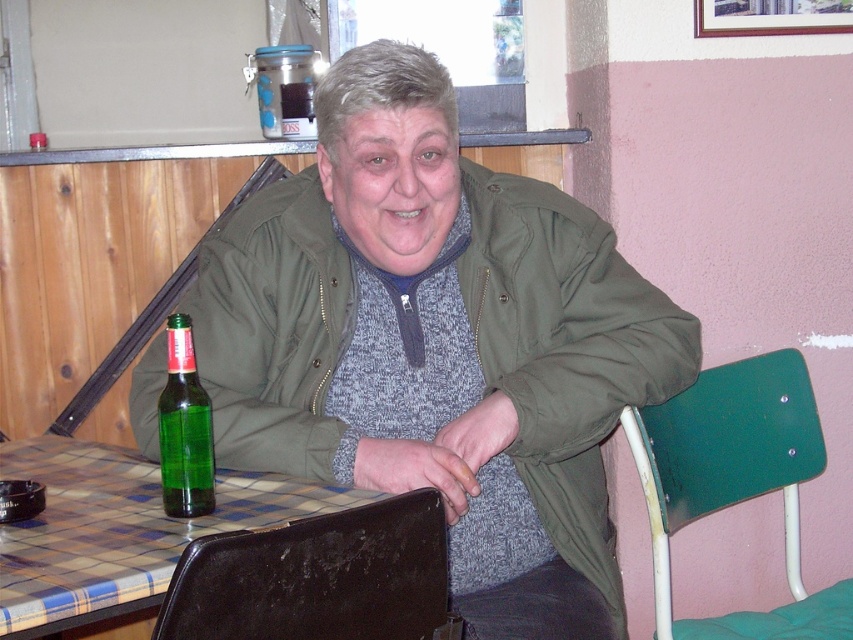
Is green plastic chair at lower right positioned behind green glass bottle at lower left?

Yes, green plastic chair at lower right is further from the viewer.

Does green plastic chair at lower right have a larger size compared to green glass bottle at lower left?

Indeed, green plastic chair at lower right has a larger size compared to green glass bottle at lower left.

This screenshot has width=853, height=640. Identify the location of green plastic chair at lower right. (726, 454).

Can you confirm if plaid fabric table at lower left is positioned to the right of green plastic chair at lower right?

In fact, plaid fabric table at lower left is to the left of green plastic chair at lower right.

Which is more to the right, plaid fabric table at lower left or green plastic chair at lower right?

From the viewer's perspective, green plastic chair at lower right appears more on the right side.

Does point (99, 524) come farther from viewer compared to point (646, 465)?

No, (99, 524) is closer to viewer.

Find the location of `plaid fabric table at lower left`. plaid fabric table at lower left is located at coordinates (119, 528).

Can you confirm if black leather chair at lower center is bigger than green plastic chair at lower right?

Actually, black leather chair at lower center might be smaller than green plastic chair at lower right.

Between black leather chair at lower center and green plastic chair at lower right, which one is positioned higher?

black leather chair at lower center is above.

Is point (276, 573) behind point (653, 490)?

No, (276, 573) is closer to viewer.

In order to click on black leather chair at lower center in this screenshot , I will do `click(318, 577)`.